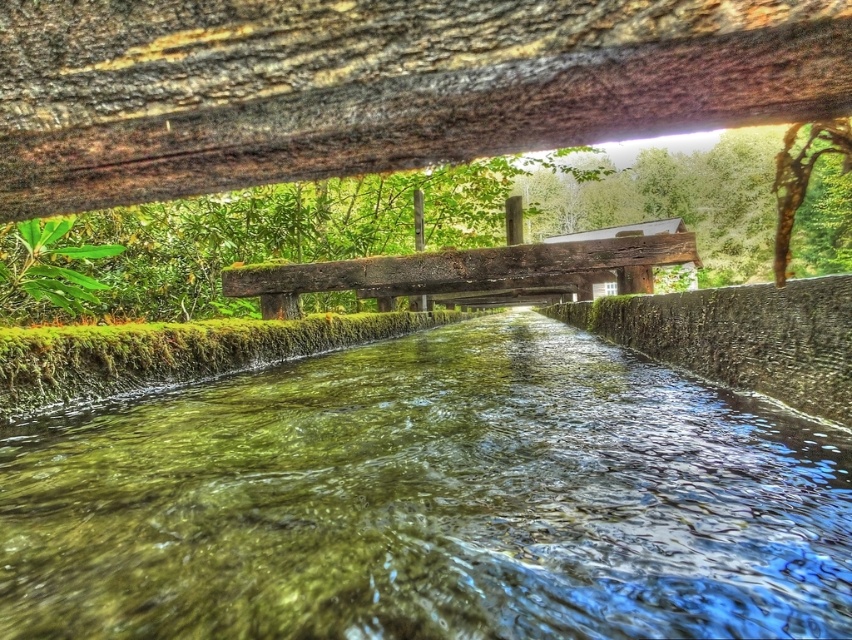
From the picture: Is green mossy river at center below rustic wooden bridge at center?

Indeed, green mossy river at center is positioned under rustic wooden bridge at center.

Who is more forward, (617, 355) or (469, 284)?

Point (617, 355) is more forward.

The height and width of the screenshot is (640, 852). I want to click on green mossy river at center, so click(430, 500).